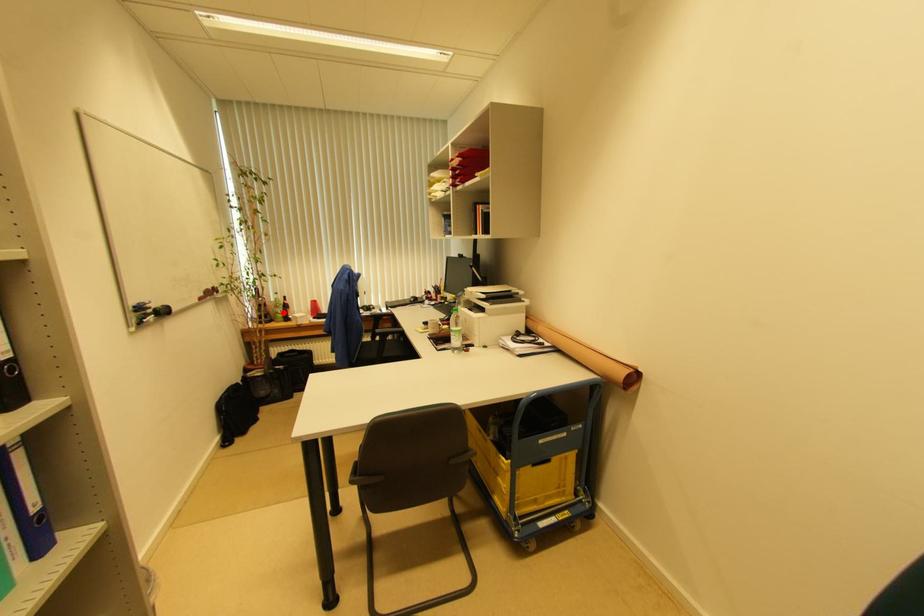
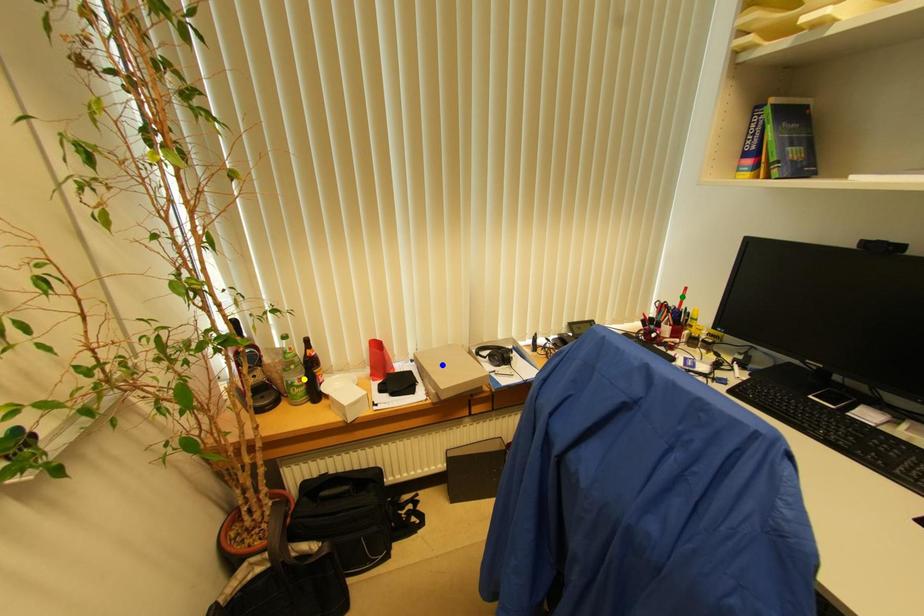
Question: I am providing you with two images of the same scene from different viewpoints. A red point is marked on the first image. You are given multiple points on the second image. Can you choose the point in image 2 that corresponds to the point in image 1?

Choices:
 (A) green point
 (B) yellow point
 (C) blue point

Answer: (B)